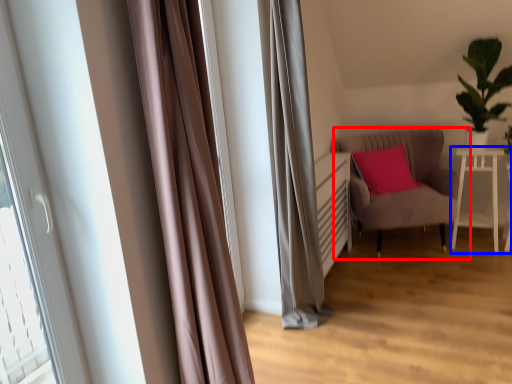
Question: Among these objects, which one is nearest to the camera, chair (highlighted by a red box) or table (highlighted by a blue box)?

Choices:
 (A) chair
 (B) table

Answer: (A)